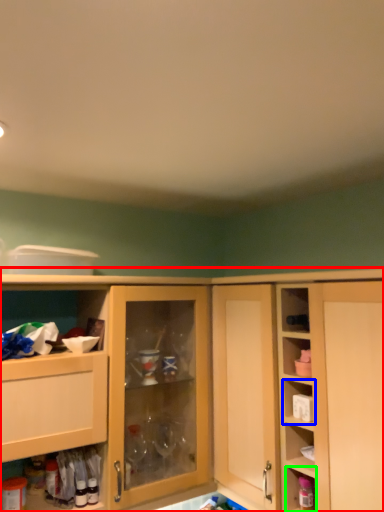
Question: Which is nearer to the cabinetry (highlighted by a red box)? shelf (highlighted by a blue box) or cabinet (highlighted by a green box).

Choices:
 (A) shelf
 (B) cabinet

Answer: (A)